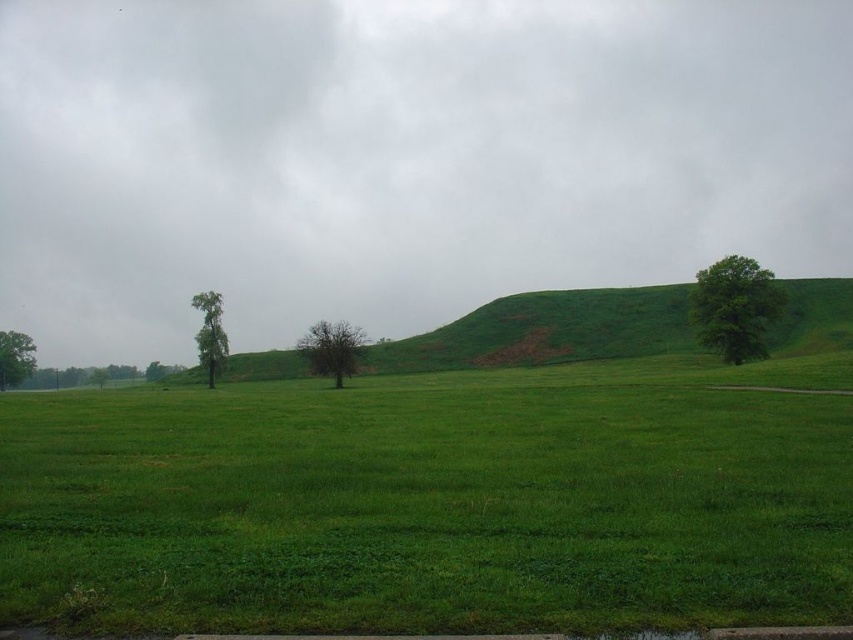
You are standing at the center of the field and want to reach the green leafy tree at left. Which direction should you walk to get there?

You should walk to the left to reach the green leafy tree at left since it is located at point (210, 332).

You are standing at the camera position looking at the green leafy tree at left. If you walk straight towards the tree for 300 feet, will you reach it?

The green leafy tree at left and camera are 319.35 feet apart, so walking straight for 300 feet will not reach it. You need to walk an additional 19.35 feet to reach the tree.